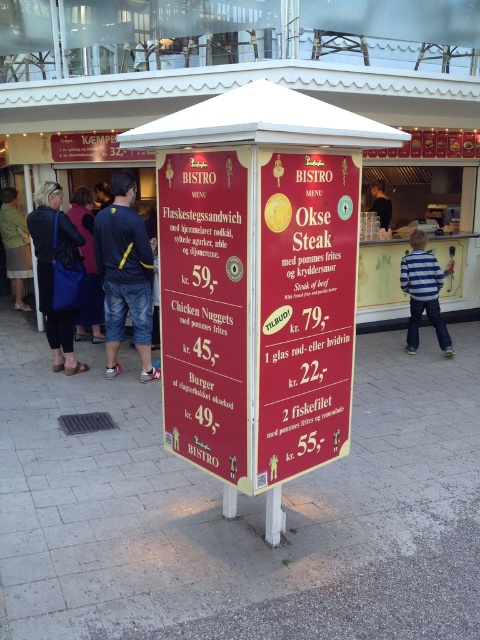
Who is positioned more to the right, denim shorts at left or light beige skirt at lower left?

denim shorts at left is more to the right.

Who is more forward, (128, 300) or (13, 256)?

Point (128, 300) is more forward.

Identify the location of denim shorts at left. (124, 275).

Can you confirm if red matte sign at center is thinner than light beige skirt at lower left?

Yes.

Which is more to the left, red matte sign at center or light beige skirt at lower left?

light beige skirt at lower left is more to the left.

Is point (344, 243) positioned behind point (13, 188)?

No, (344, 243) is closer to viewer.

This screenshot has width=480, height=640. What are the coordinates of `red matte sign at center` in the screenshot? It's located at (305, 310).

Is red glossy menu board at center above velvet purple jacket at center?

No, red glossy menu board at center is not above velvet purple jacket at center.

In order to click on red glossy menu board at center in this screenshot , I will do `click(257, 308)`.

Is point (305, 330) less distant than point (84, 227)?

Yes, point (305, 330) is in front of point (84, 227).

Where is `red glossy menu board at center`? Image resolution: width=480 pixels, height=640 pixels. red glossy menu board at center is located at coordinates (257, 308).